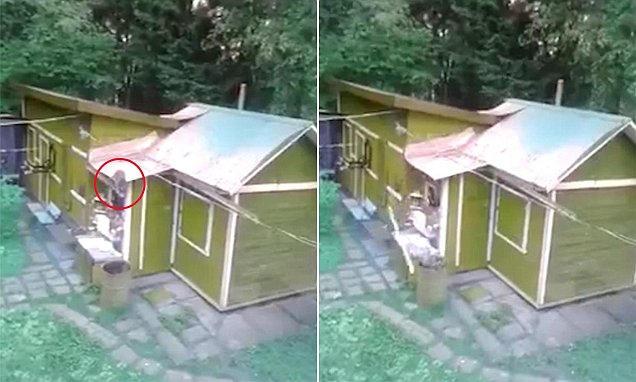
Where is `trash`? This screenshot has width=636, height=382. trash is located at coordinates (434, 267).